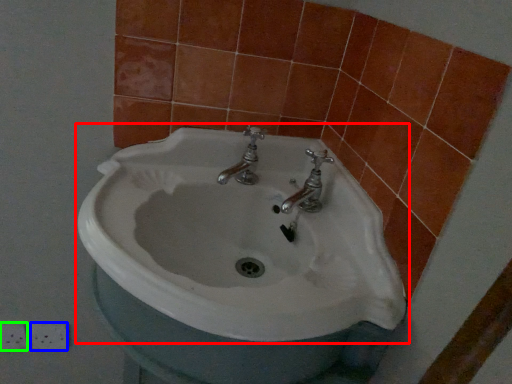
Question: Estimate the real-world distances between objects in this image. Which object is farther from sink (highlighted by a red box), ceramic tile (highlighted by a blue box) or ceramic tile (highlighted by a green box)?

Choices:
 (A) ceramic tile
 (B) ceramic tile

Answer: (B)